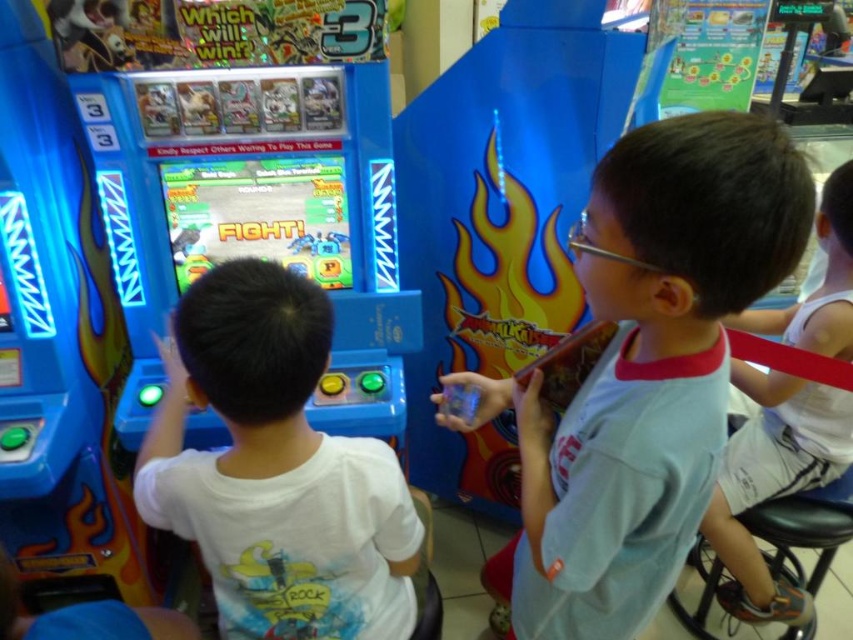
Question: Is light blue fabric shirt at center to the right of white cotton shirt at right from the viewer's perspective?

Choices:
 (A) yes
 (B) no

Answer: (B)

Question: Which of the following is the farthest from the observer?

Choices:
 (A) shiny plastic screen at center
 (B) light blue fabric shirt at center
 (C) white matte shirt at center

Answer: (A)

Question: Among these points, which one is nearest to the camera?

Choices:
 (A) (283, 476)
 (B) (798, 333)
 (C) (247, 177)

Answer: (A)

Question: Which is nearer to the white matte shirt at center?

Choices:
 (A) light blue fabric shirt at center
 (B) white cotton shirt at right

Answer: (A)

Question: Does light blue fabric shirt at center have a lesser width compared to shiny plastic screen at center?

Choices:
 (A) yes
 (B) no

Answer: (A)

Question: Does light blue fabric shirt at center appear on the left side of shiny plastic screen at center?

Choices:
 (A) no
 (B) yes

Answer: (A)